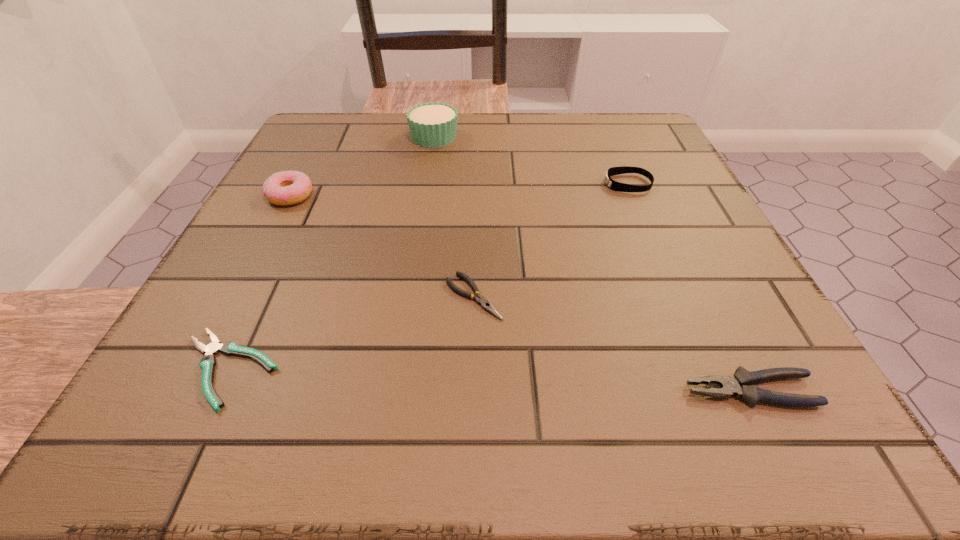
Where is `cupcake`? cupcake is located at coordinates point(434,124).

You are a GUI agent. You are given a task and a screenshot of the screen. Output one action in this format:
    pyautogui.click(x=<x>, y=<y>)
    Task: Click on the tallest object
    The image size is (960, 540).
    Given the screenshot: What is the action you would take?
    pyautogui.click(x=434, y=124)

The image size is (960, 540). I want to click on the second tallest object, so click(x=283, y=188).

In order to click on wristband in this screenshot , I will do `click(613, 185)`.

The width and height of the screenshot is (960, 540). In order to click on the tallest pliers in this screenshot , I will do `click(739, 384)`.

The image size is (960, 540). I want to click on the second shortest object, so click(x=480, y=300).

Locate an element on the screen. the second shortest pliers is located at coordinates (480, 300).

Where is `the shortest object`? the shortest object is located at coordinates (208, 362).

The height and width of the screenshot is (540, 960). In order to click on the leftmost pliers in this screenshot , I will do `click(208, 362)`.

Where is `free region located on the back of the farthest object`? free region located on the back of the farthest object is located at coordinates pyautogui.click(x=438, y=115).